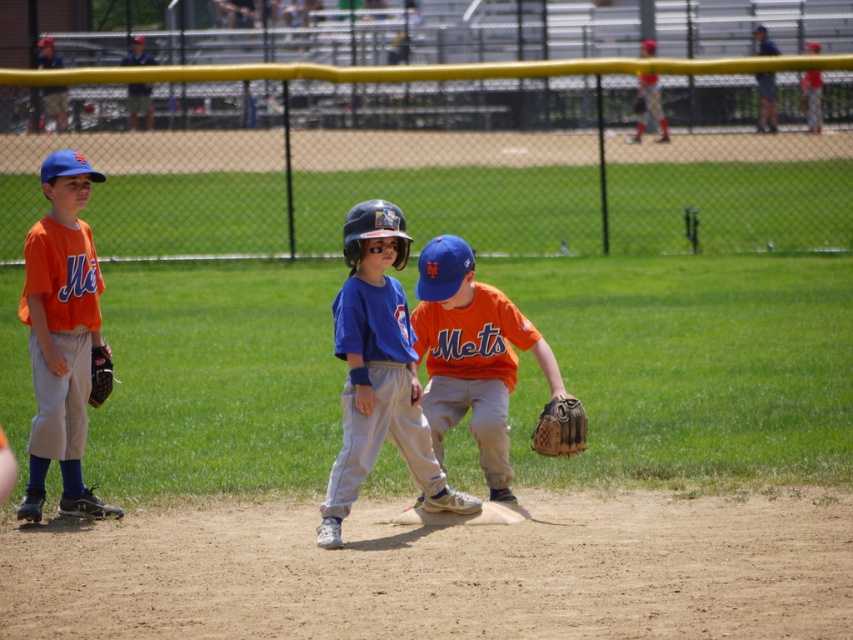
You are a coach observing the baseball game. You notice two baseball gloves in the scene. Which glove is placed higher up in the image, the orange matte baseball glove at center or the brown leather baseball glove at lower center?

The orange matte baseball glove at center is positioned over the brown leather baseball glove at lower center, so it is placed higher up in the image.

You are a coach observing the game and need to choose a glove for a player who requires a larger size. Which glove between the orange matte baseball glove at center and the brown leather baseball glove at lower center should you pick?

The orange matte baseball glove at center is bigger than the brown leather baseball glove at lower center, so you should pick the orange matte baseball glove at center.